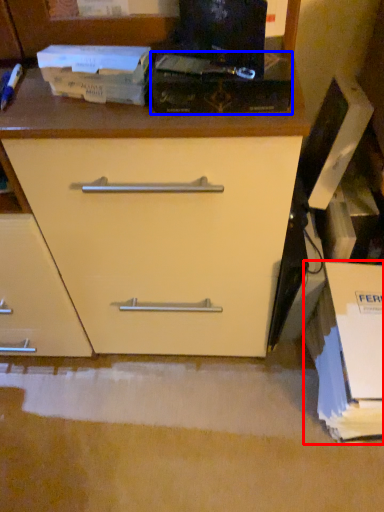
Question: Among these objects, which one is nearest to the camera, cardboard box (highlighted by a red box) or paperback book (highlighted by a blue box)?

Choices:
 (A) cardboard box
 (B) paperback book

Answer: (B)